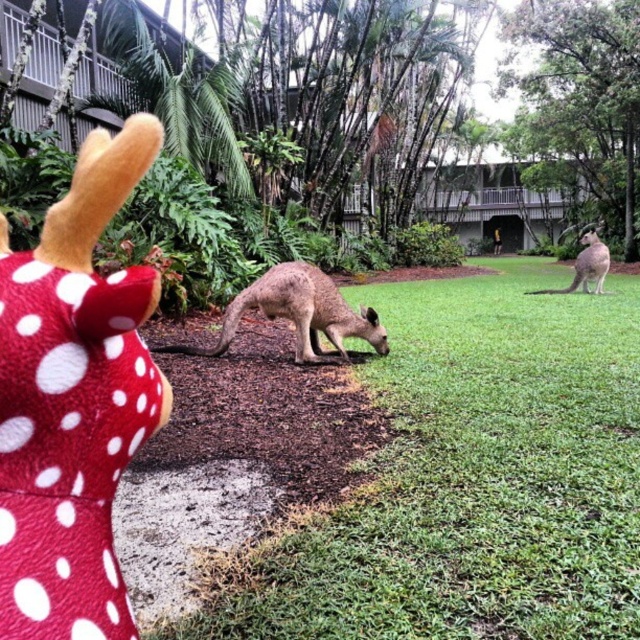
Question: Can you confirm if green grass at center is bigger than red polka dot plush at left?

Choices:
 (A) yes
 (B) no

Answer: (A)

Question: Which of the following is the closest to the observer?

Choices:
 (A) red polka dot plush at left
 (B) green grass at center
 (C) brown fur kangaroo at right
 (D) light brown fur at center

Answer: (A)

Question: Which point is farther to the camera?

Choices:
 (A) green grass at center
 (B) light brown fur at center
 (C) red polka dot plush at left

Answer: (B)

Question: Can you confirm if light brown fur at center is positioned to the left of brown fur kangaroo at right?

Choices:
 (A) yes
 (B) no

Answer: (A)

Question: Can you confirm if red polka dot plush at left is positioned to the right of brown fur kangaroo at right?

Choices:
 (A) yes
 (B) no

Answer: (B)

Question: Which point appears closest to the camera in this image?

Choices:
 (A) (52, 273)
 (B) (586, 236)
 (C) (308, 332)

Answer: (A)